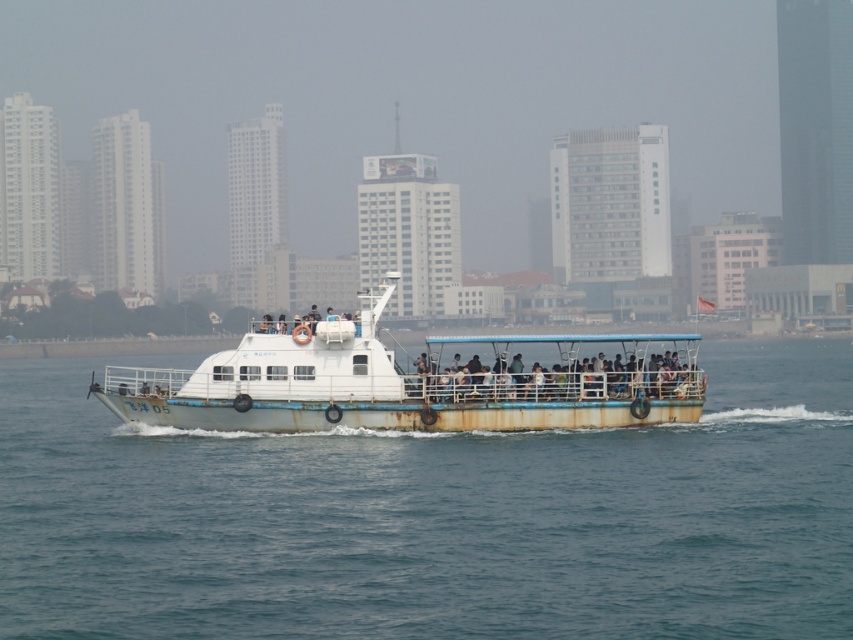
Who is shorter, blue water at center or white matte boat at center?

Standing shorter between the two is blue water at center.

Does point (526, 474) come in front of point (424, 412)?

Yes, point (526, 474) is closer to viewer.

You are a GUI agent. You are given a task and a screenshot of the screen. Output one action in this format:
    pyautogui.click(x=<x>, y=<y>)
    Task: Click on the blue water at center
    
    Given the screenshot: What is the action you would take?
    pyautogui.click(x=434, y=516)